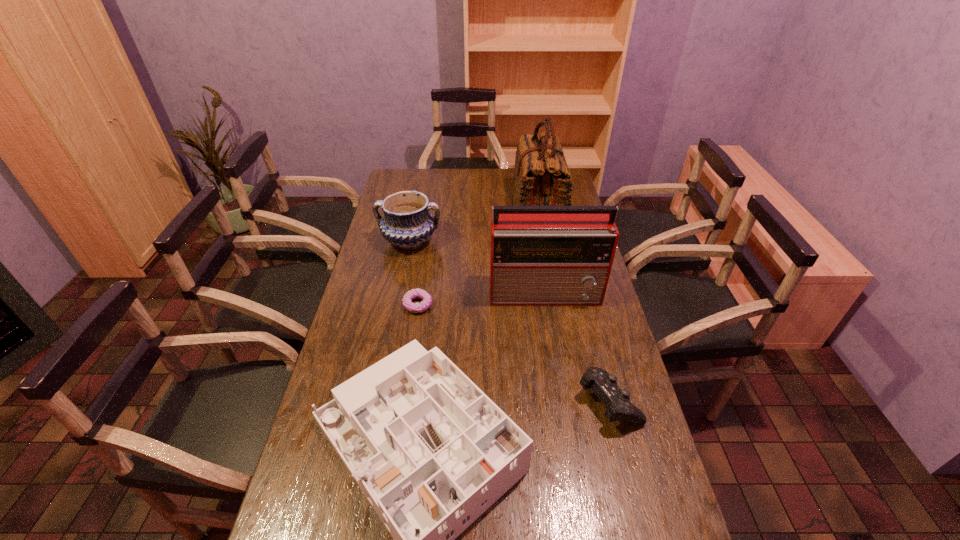
Identify the location of free region located on the front of the control. (632, 495).

The width and height of the screenshot is (960, 540). I want to click on free space located on the front of the doughnut, so tap(407, 374).

Image resolution: width=960 pixels, height=540 pixels. What are the coordinates of `object at the far edge` in the screenshot? It's located at click(x=541, y=176).

Where is `object that is at the left edge`? The image size is (960, 540). object that is at the left edge is located at coordinates (407, 223).

Locate an element on the screen. This screenshot has height=540, width=960. shopping bag located in the right edge section of the desktop is located at coordinates (541, 176).

The image size is (960, 540). Find the location of `radio receiver that is at the right edge`. radio receiver that is at the right edge is located at coordinates (x=539, y=255).

Where is `control that is at the right edge`? This screenshot has height=540, width=960. control that is at the right edge is located at coordinates (604, 385).

Identify the location of object that is at the far right corner. (541, 176).

Identify the location of vacant region at the far edge of the desktop. The image size is (960, 540). (x=442, y=171).

The image size is (960, 540). I want to click on vacant region at the left edge, so click(345, 522).